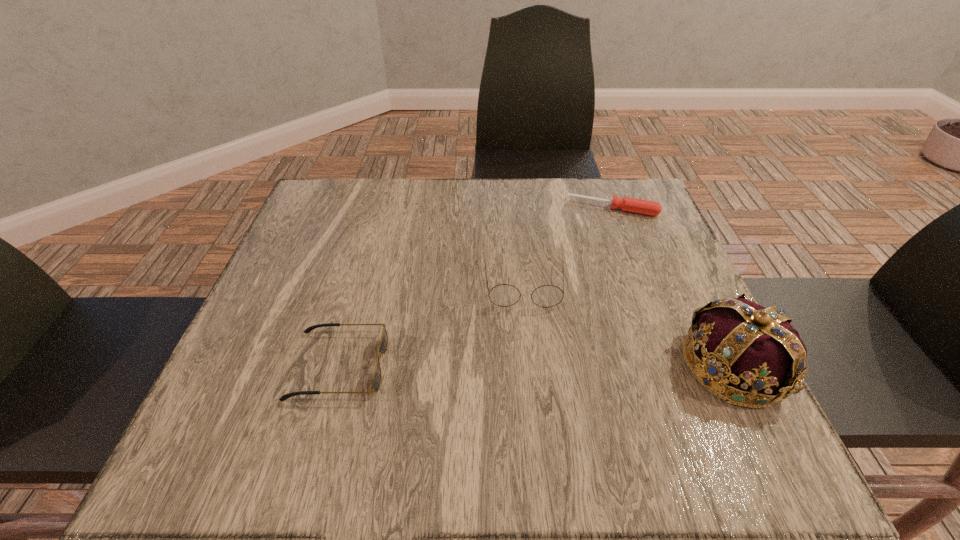
Locate an element on the screen. The width and height of the screenshot is (960, 540). empty space between the third nearest object and the second shortest object is located at coordinates (431, 324).

Locate which object is the closest to the crown. Please provide its 2D coordinates. Your answer should be formatted as a tuple, i.e. [(x, y)], where the tuple contains the x and y coordinates of a point satisfying the conditions above.

[(504, 295)]

Where is `object that stands as the third closest to the tallest object`? The width and height of the screenshot is (960, 540). object that stands as the third closest to the tallest object is located at coordinates (383, 346).

The image size is (960, 540). I want to click on vacant space that satisfies the following two spatial constraints: 1. on the back side of the screwdriver; 2. on the left side of the second farthest object, so point(516,208).

This screenshot has width=960, height=540. What are the coordinates of `free spot that satisfies the following two spatial constraints: 1. on the back side of the screwdriver; 2. on the right side of the second farthest object` in the screenshot? It's located at (516, 208).

Identify the location of blank space that satisfies the following two spatial constraints: 1. on the back side of the second object from left to right; 2. on the left side of the screwdriver. The image size is (960, 540). (516, 208).

The image size is (960, 540). Find the location of `free region that satisfies the following two spatial constraints: 1. on the front side of the third nearest object; 2. on the right side of the tallest object`. free region that satisfies the following two spatial constraints: 1. on the front side of the third nearest object; 2. on the right side of the tallest object is located at coordinates (533, 366).